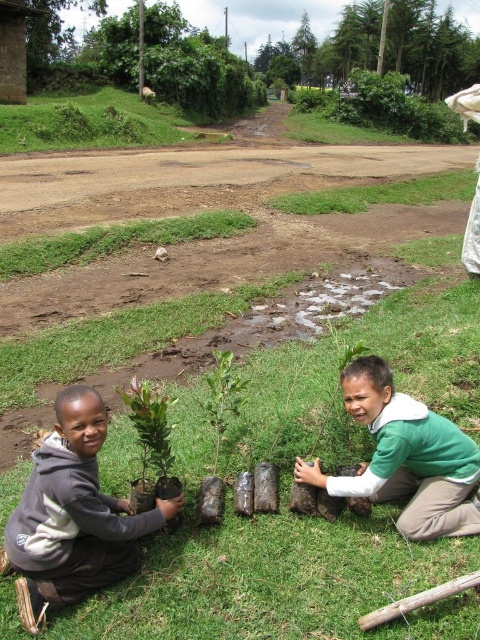
You are a gardener trying to plant a new sapling. You see the green grass at center and the green matte plant at center. Which object is closer to you?

The green grass at center is closer to you because it is in front of the green matte plant at center.

Based on the scene description, which object is taller between the green leafy tree at upper center and the green leafy plant at center?

The green leafy tree at upper center is much taller than the green leafy plant at center.